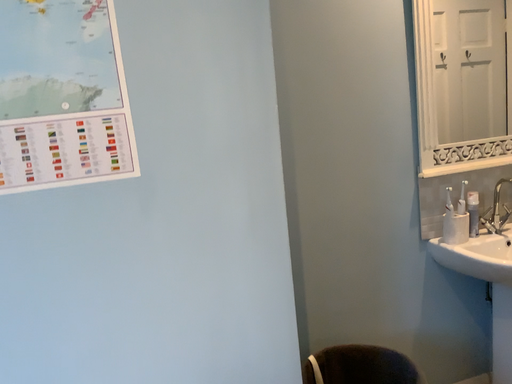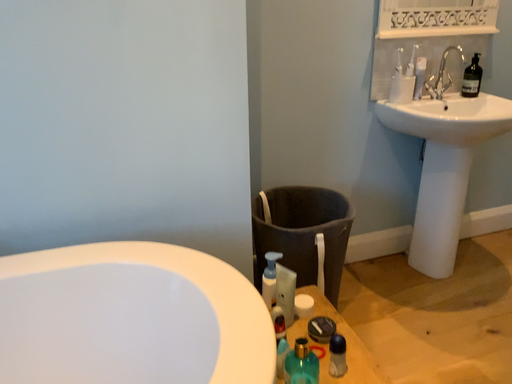
Question: How did the camera likely rotate when shooting the video?

Choices:
 (A) rotated downward
 (B) rotated upward

Answer: (A)